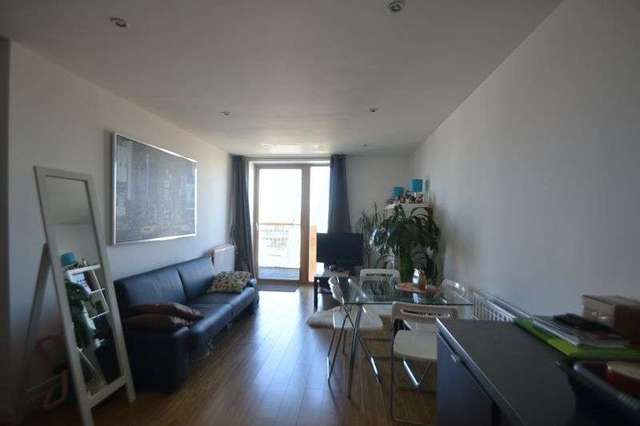
The width and height of the screenshot is (640, 426). What are the coordinates of `chair` in the screenshot? It's located at (371, 319), (409, 343), (384, 313).